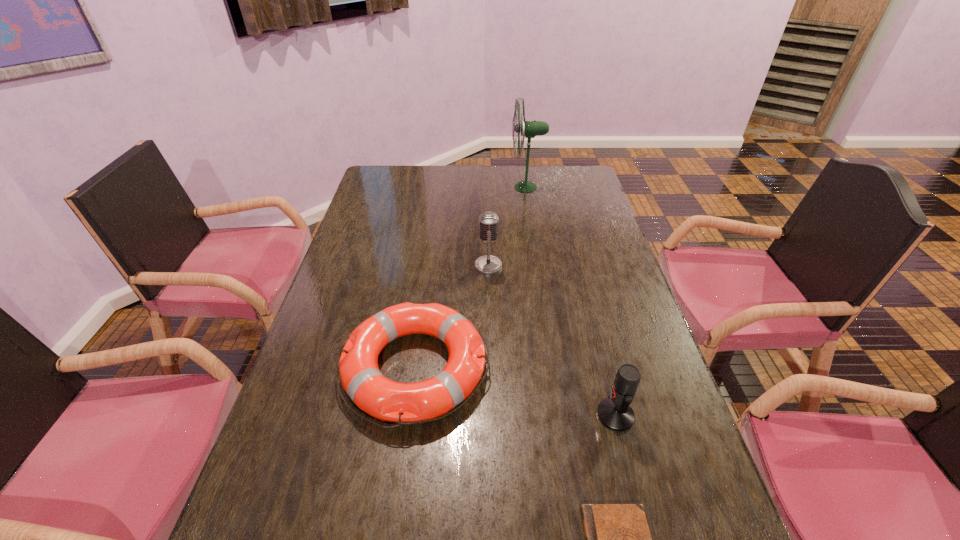
In the image, there is a desktop. Identify the location of free region at the right edge. The width and height of the screenshot is (960, 540). (690, 520).

Where is `vacant space at the far right corner of the desktop`? vacant space at the far right corner of the desktop is located at coordinates (558, 168).

What are the coordinates of `free space between the shorter microphone and the life buoy` in the screenshot? It's located at (515, 392).

This screenshot has height=540, width=960. Find the location of `vacant area that lies between the left microphone and the farthest object`. vacant area that lies between the left microphone and the farthest object is located at coordinates click(507, 227).

Identify the location of empty location between the shorter microphone and the left microphone. This screenshot has width=960, height=540. (552, 341).

You are a GUI agent. You are given a task and a screenshot of the screen. Output one action in this format:
    pyautogui.click(x=<x>, y=<y>)
    Task: Click on the free space between the fourth tallest object and the farthest object
    
    Given the screenshot: What is the action you would take?
    point(470,278)

Identify the location of object that is the third closest to the nearest object. The height and width of the screenshot is (540, 960). (488, 221).

Image resolution: width=960 pixels, height=540 pixels. I want to click on object identified as the second closest to the farthest object, so click(405, 403).